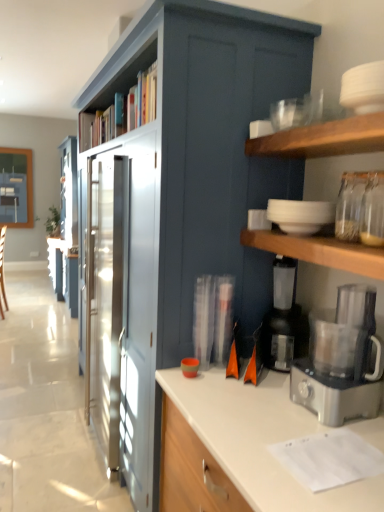
Question: Is satin blue cabinet at center outside satin silver food processor at right?

Choices:
 (A) yes
 (B) no

Answer: (A)

Question: Can you confirm if satin blue cabinet at center is taller than satin silver food processor at right?

Choices:
 (A) yes
 (B) no

Answer: (A)

Question: Is satin blue cabinet at center facing away from satin silver food processor at right?

Choices:
 (A) yes
 (B) no

Answer: (B)

Question: From a real-world perspective, is satin blue cabinet at center below satin silver food processor at right?

Choices:
 (A) no
 (B) yes

Answer: (A)

Question: Is satin blue cabinet at center smaller than satin silver food processor at right?

Choices:
 (A) yes
 (B) no

Answer: (B)

Question: Does satin blue cabinet at center appear on the left side of satin silver food processor at right?

Choices:
 (A) no
 (B) yes

Answer: (B)

Question: Is wooden bookshelf at upper center positioned behind black plastic coffee maker at lower right, which is the first appliance from bottom to top?

Choices:
 (A) yes
 (B) no

Answer: (A)

Question: Is wooden bookshelf at upper center not inside black plastic coffee maker at lower right, the second appliance in the top-to-bottom sequence?

Choices:
 (A) yes
 (B) no

Answer: (A)

Question: Is wooden bookshelf at upper center facing away from black plastic coffee maker at lower right, the second appliance in the top-to-bottom sequence?

Choices:
 (A) yes
 (B) no

Answer: (B)

Question: From the image's perspective, is wooden bookshelf at upper center on black plastic coffee maker at lower right, the second appliance in the top-to-bottom sequence?

Choices:
 (A) yes
 (B) no

Answer: (A)

Question: Does wooden bookshelf at upper center have a lesser width compared to black plastic coffee maker at lower right, the second appliance in the top-to-bottom sequence?

Choices:
 (A) no
 (B) yes

Answer: (A)

Question: Is wooden bookshelf at upper center at the left side of black plastic coffee maker at lower right, which is the first appliance from bottom to top?

Choices:
 (A) yes
 (B) no

Answer: (A)

Question: Is white matte bowls at upper right, the 2th appliance ordered from the bottom, oriented towards wooden bookshelf at upper center?

Choices:
 (A) yes
 (B) no

Answer: (B)